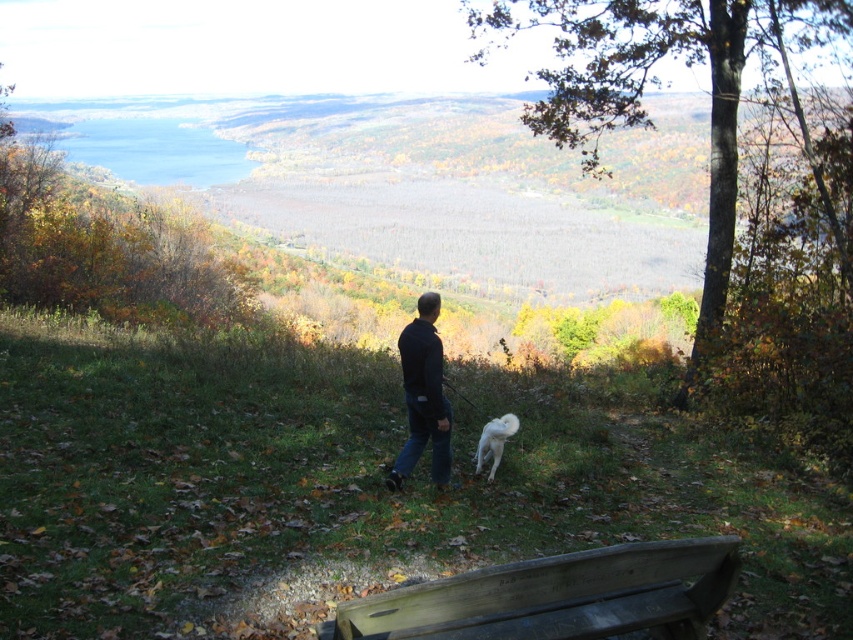
Between wooden bench at lower center and white fluffy dog at center, which one appears on the right side from the viewer's perspective?

white fluffy dog at center

Which is behind, point (569, 612) or point (508, 432)?

Positioned behind is point (508, 432).

Who is more distant from viewer, (343, 605) or (485, 458)?

The point (485, 458) is behind.

At what (x,y) coordinates should I click in order to perform the action: click on wooden bench at lower center. Please return your answer as a coordinate pair (x, y). Looking at the image, I should click on (556, 596).

Does black fabric jacket at center appear over white fluffy dog at center?

Indeed, black fabric jacket at center is positioned over white fluffy dog at center.

Between point (450, 419) and point (485, 451), which one is positioned behind?

The point (485, 451) is more distant.

Is point (433, 298) positioned in front of point (506, 419)?

Yes, it is.

At what (x,y) coordinates should I click in order to perform the action: click on black fabric jacket at center. Please return your answer as a coordinate pair (x, y). Looking at the image, I should click on (422, 396).

Is wooden bench at lower center bigger than black fabric jacket at center?

Actually, wooden bench at lower center might be smaller than black fabric jacket at center.

The image size is (853, 640). What do you see at coordinates (556, 596) in the screenshot? I see `wooden bench at lower center` at bounding box center [556, 596].

Does point (682, 595) come behind point (422, 296)?

No, it is in front of (422, 296).

The height and width of the screenshot is (640, 853). I want to click on wooden bench at lower center, so (x=556, y=596).